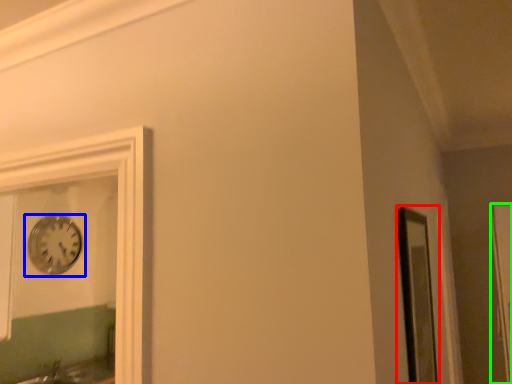
Question: Which object is the closest to the window frame (highlighted by a red box)? Choose among these: wall clock (highlighted by a blue box) or glass door (highlighted by a green box).

Choices:
 (A) wall clock
 (B) glass door

Answer: (B)